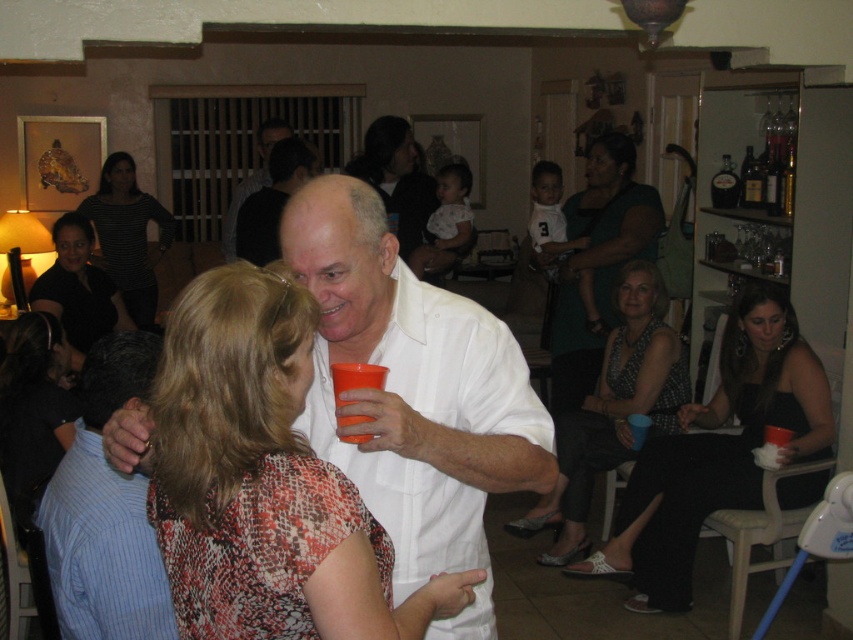
You are at a party and want to approach the person wearing the white matte shirt at center and the person in the matte green dress at center. Which one should you walk towards if you want to greet the person on the left side first?

You should greet the person wearing the white matte shirt at center first because it is positioned to the left of the matte green dress at center.

Looking at this image, you are standing at the entrance of the room and want to greet the person wearing the printed fabric dress at center. Which direction should you walk to reach them?

The printed fabric dress at center is located at point 0.613 on the x axis and 0.273 on the y axis, so you should walk towards the center of the room to reach them.

You are a photographer at the event and want to capture a photo that includes both the white matte shirt at center and the matte green dress at center. Based on their positions, which one should you focus on first to ensure both are in the frame?

The white matte shirt at center is located below the matte green dress at center, so you should focus on the matte green dress at center first to ensure both are in the frame.